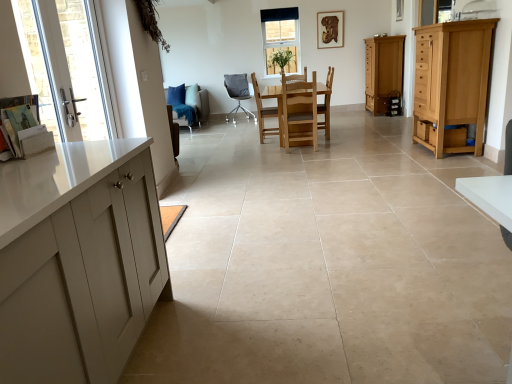
Question: Considering the relative positions of wooden drawer at lower right, the 1th drawer from the bottom, and matte wooden cabinet at right, which is the 2th cabinetry in front-to-back order, in the image provided, is wooden drawer at lower right, the 1th drawer from the bottom, in front of matte wooden cabinet at right, which is the 2th cabinetry in front-to-back order,?

Choices:
 (A) no
 (B) yes

Answer: (B)

Question: Is wooden drawer at lower right, the 1th drawer from the bottom, positioned far away from matte wooden cabinet at right, the 1th cabinetry in the back-to-front sequence?

Choices:
 (A) no
 (B) yes

Answer: (B)

Question: From a real-world perspective, is wooden drawer at lower right, acting as the 1th drawer starting from the front, physically above matte wooden cabinet at right, the 1th cabinetry in the back-to-front sequence?

Choices:
 (A) yes
 (B) no

Answer: (B)

Question: From the image's perspective, is wooden drawer at lower right, the first drawer from the left, beneath matte wooden cabinet at right, the 1th cabinetry in the back-to-front sequence?

Choices:
 (A) yes
 (B) no

Answer: (A)

Question: Considering the relative sizes of wooden drawer at lower right, the first drawer from the left, and matte wooden cabinet at right, which is the 2th cabinetry in front-to-back order, in the image provided, is wooden drawer at lower right, the first drawer from the left, smaller than matte wooden cabinet at right, which is the 2th cabinetry in front-to-back order,?

Choices:
 (A) yes
 (B) no

Answer: (A)

Question: Relative to clear glass door at left, is wooden frame window at upper center in front or behind?

Choices:
 (A) behind
 (B) front

Answer: (A)

Question: Is wooden frame window at upper center situated inside clear glass door at left or outside?

Choices:
 (A) outside
 (B) inside

Answer: (A)

Question: Is wooden frame window at upper center taller or shorter than clear glass door at left?

Choices:
 (A) short
 (B) tall

Answer: (B)

Question: From a real-world perspective, relative to clear glass door at left, is wooden frame window at upper center vertically above or below?

Choices:
 (A) below
 (B) above

Answer: (B)

Question: Considering the positions of point (282, 74) and point (60, 130), is point (282, 74) closer or farther from the camera than point (60, 130)?

Choices:
 (A) farther
 (B) closer

Answer: (A)

Question: From the image's perspective, relative to clear glass door at left, is light brown wooden chair at center, placed as the 2th chair when sorted from right to left, above or below?

Choices:
 (A) below
 (B) above

Answer: (B)

Question: Do you think light brown wooden chair at center, placed as the 2th chair when sorted from right to left, is within clear glass door at left, or outside of it?

Choices:
 (A) outside
 (B) inside

Answer: (A)

Question: In terms of width, does light brown wooden chair at center, acting as the fourth chair starting from the left, look wider or thinner when compared to clear glass door at left?

Choices:
 (A) wide
 (B) thin

Answer: (A)

Question: From a real-world perspective, relative to light brown wooden chair at center, acting as the fourth chair starting from the left, is light brown wood cabinet at right, the 1th cabinetry when ordered from front to back, vertically above or below?

Choices:
 (A) below
 (B) above

Answer: (B)

Question: Is light brown wood cabinet at right, the 1th cabinetry when ordered from front to back, inside or outside of light brown wooden chair at center, placed as the 2th chair when sorted from right to left?

Choices:
 (A) outside
 (B) inside

Answer: (A)